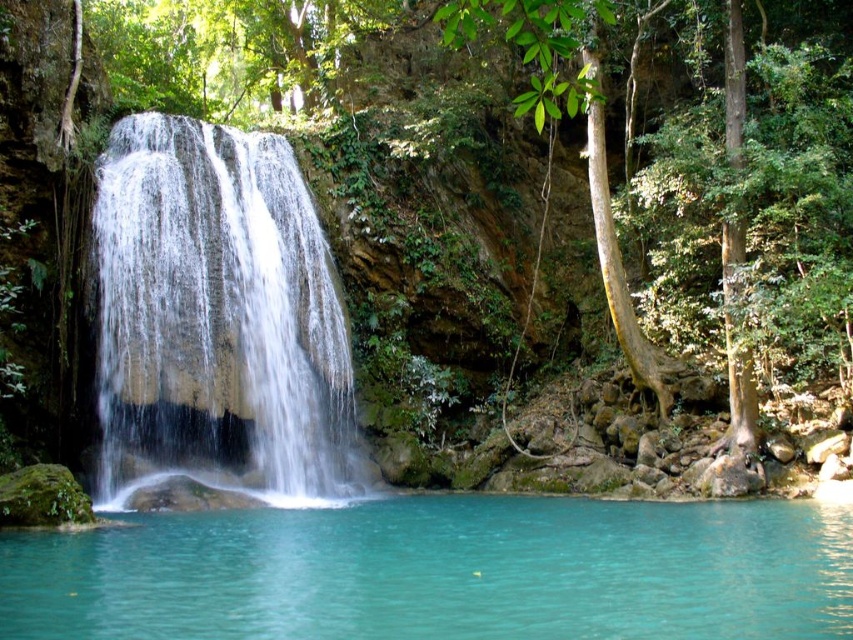
Question: Does turquoise liquid at center have a smaller size compared to white smooth waterfall at center?

Choices:
 (A) no
 (B) yes

Answer: (B)

Question: Observing the image, what is the correct spatial positioning of turquoise liquid at center in reference to white smooth waterfall at center?

Choices:
 (A) right
 (B) left

Answer: (A)

Question: Which of the following is the closest to the observer?

Choices:
 (A) white smooth waterfall at center
 (B) turquoise liquid at center

Answer: (B)

Question: Does turquoise liquid at center have a greater width compared to white smooth waterfall at center?

Choices:
 (A) no
 (B) yes

Answer: (B)